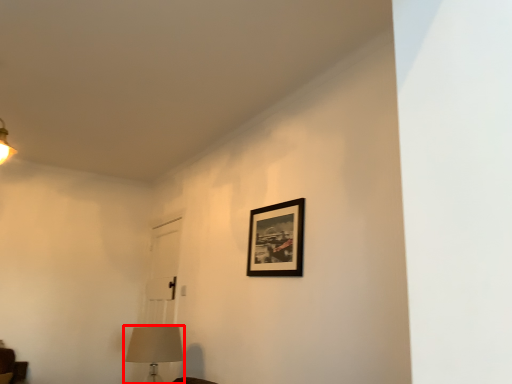
Question: From the image's perspective, considering the relative positions of table lamp (annotated by the red box) and picture frame in the image provided, where is table lamp (annotated by the red box) located with respect to the staircase?

Choices:
 (A) above
 (B) below

Answer: (B)